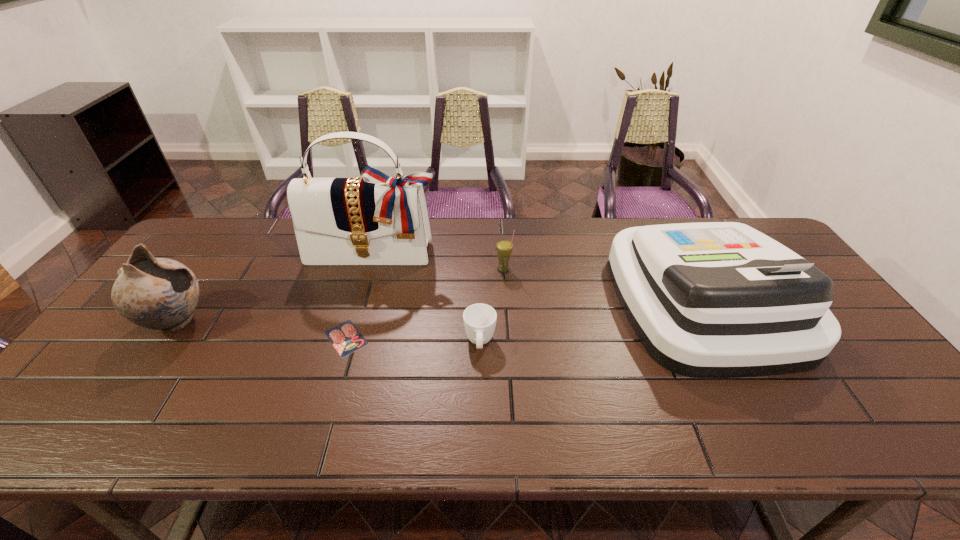
Locate an element on the screen. The height and width of the screenshot is (540, 960). blank space at the near edge of the desktop is located at coordinates (236, 417).

Where is `free space at the left edge of the desktop`? This screenshot has height=540, width=960. free space at the left edge of the desktop is located at coordinates (212, 274).

Identify the location of vacant space at the far left corner of the desktop. The height and width of the screenshot is (540, 960). (201, 255).

This screenshot has height=540, width=960. I want to click on vacant area at the near left corner of the desktop, so click(x=70, y=424).

Locate an element on the screen. This screenshot has height=540, width=960. free space at the near right corner of the desktop is located at coordinates (865, 430).

The image size is (960, 540). Find the location of `vacant area that lies between the tallest object and the third shortest object`. vacant area that lies between the tallest object and the third shortest object is located at coordinates (439, 262).

I want to click on free space between the salami and the cash register, so click(525, 320).

Find the location of a particular element. This screenshot has height=540, width=960. vacant space in between the pottery and the shortest object is located at coordinates (261, 330).

Find the location of a particular element. empty location between the leftmost object and the third shortest object is located at coordinates (340, 296).

This screenshot has height=540, width=960. In order to click on empty location between the salami and the satchel in this screenshot , I will do `click(360, 296)`.